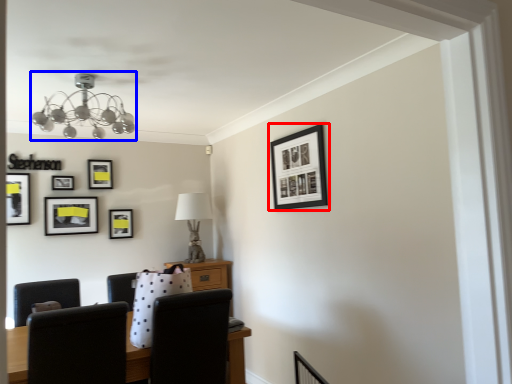
Question: Which object is further to the camera taking this photo, picture frame (highlighted by a red box) or lamp (highlighted by a blue box)?

Choices:
 (A) picture frame
 (B) lamp

Answer: (A)